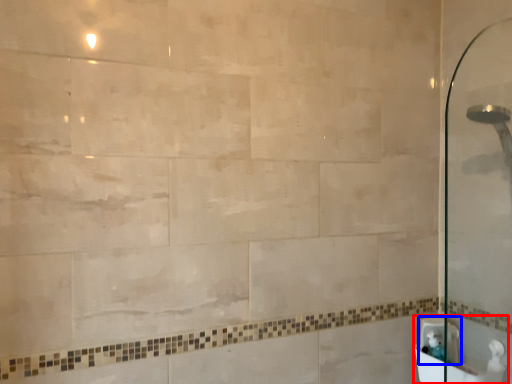
Question: Which object appears farthest to the camera in this image, sink (highlighted by a red box) or sink (highlighted by a blue box)?

Choices:
 (A) sink
 (B) sink

Answer: (B)